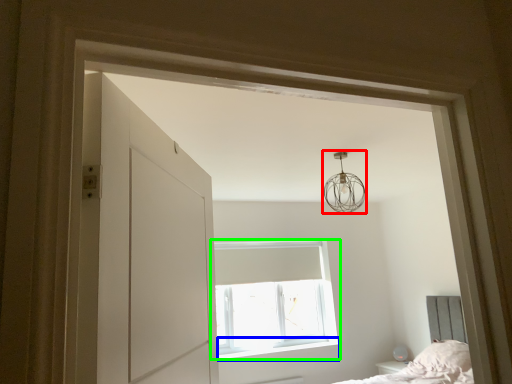
Question: Which is nearer to the lamp (highlighted by a red box)? window sill (highlighted by a blue box) or window (highlighted by a green box).

Choices:
 (A) window sill
 (B) window

Answer: (B)